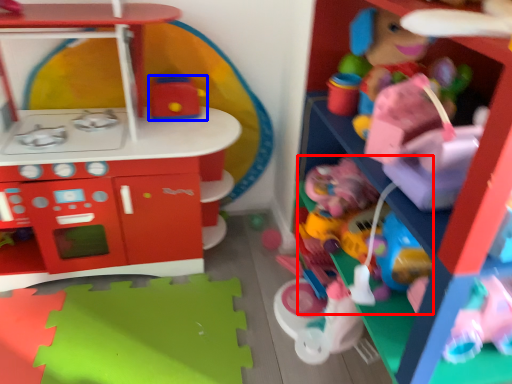
Question: Which object is further to the camera taking this photo, toy (highlighted by a red box) or toy (highlighted by a blue box)?

Choices:
 (A) toy
 (B) toy

Answer: (B)